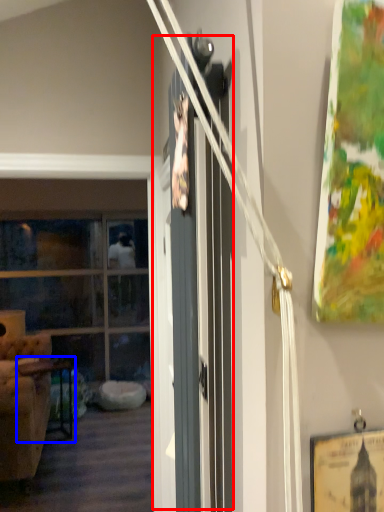
Question: Which point is closer to the camera, barn door (highlighted by a red box) or table (highlighted by a blue box)?

Choices:
 (A) barn door
 (B) table

Answer: (A)